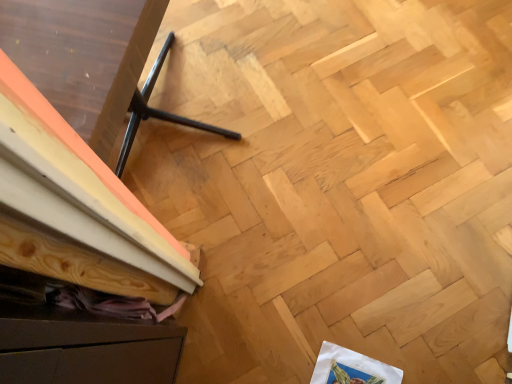
Question: Is black metal tripod at lower left oriented towards white paper at lower right?

Choices:
 (A) yes
 (B) no

Answer: (B)

Question: Considering the relative sizes of black metal tripod at lower left and white paper at lower right in the image provided, is black metal tripod at lower left thinner than white paper at lower right?

Choices:
 (A) yes
 (B) no

Answer: (B)

Question: Considering the relative sizes of black metal tripod at lower left and white paper at lower right in the image provided, is black metal tripod at lower left bigger than white paper at lower right?

Choices:
 (A) no
 (B) yes

Answer: (B)

Question: Is black metal tripod at lower left shorter than white paper at lower right?

Choices:
 (A) no
 (B) yes

Answer: (A)

Question: From a real-world perspective, is black metal tripod at lower left physically below white paper at lower right?

Choices:
 (A) yes
 (B) no

Answer: (B)

Question: Is black metal tripod at lower left at the left side of white paper at lower right?

Choices:
 (A) yes
 (B) no

Answer: (A)

Question: From the image's perspective, is brown matte drawer at lower left located above white paper at lower right?

Choices:
 (A) yes
 (B) no

Answer: (A)

Question: Considering the relative sizes of brown matte drawer at lower left and white paper at lower right in the image provided, is brown matte drawer at lower left shorter than white paper at lower right?

Choices:
 (A) no
 (B) yes

Answer: (A)

Question: Is white paper at lower right surrounded by brown matte drawer at lower left?

Choices:
 (A) no
 (B) yes

Answer: (A)

Question: Is brown matte drawer at lower left in front of white paper at lower right?

Choices:
 (A) yes
 (B) no

Answer: (A)

Question: Is brown matte drawer at lower left not within white paper at lower right?

Choices:
 (A) no
 (B) yes

Answer: (B)

Question: Is brown matte drawer at lower left smaller than white paper at lower right?

Choices:
 (A) yes
 (B) no

Answer: (B)

Question: Can you confirm if black metal tripod at lower left is positioned to the right of brown matte drawer at lower left?

Choices:
 (A) yes
 (B) no

Answer: (B)